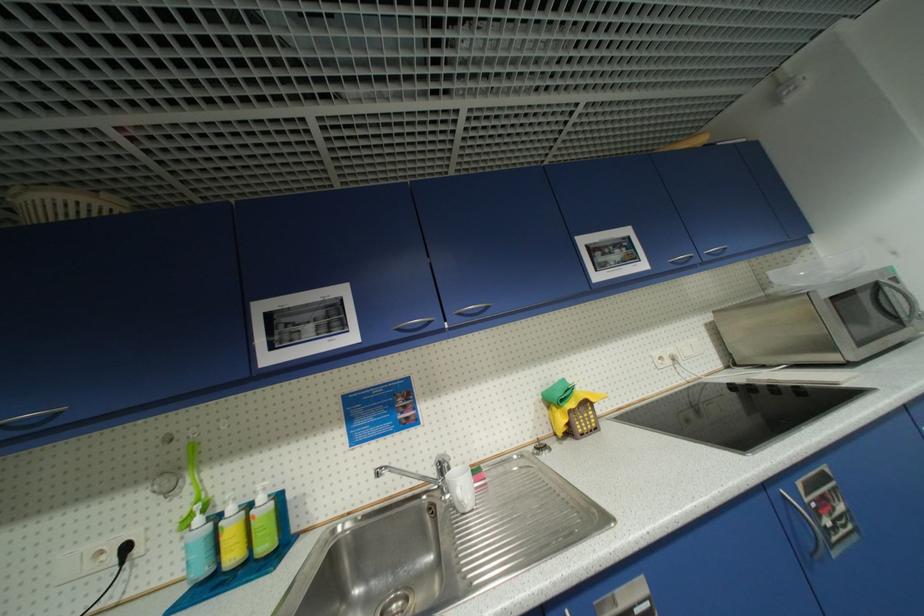
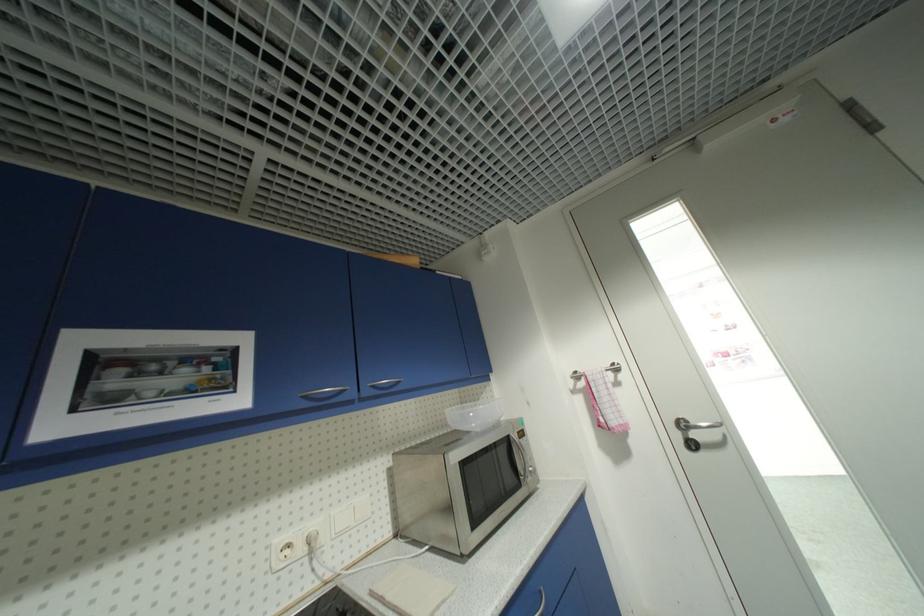
In the second image, find the point that corresponds to point (666, 359) in the first image.

(294, 546)